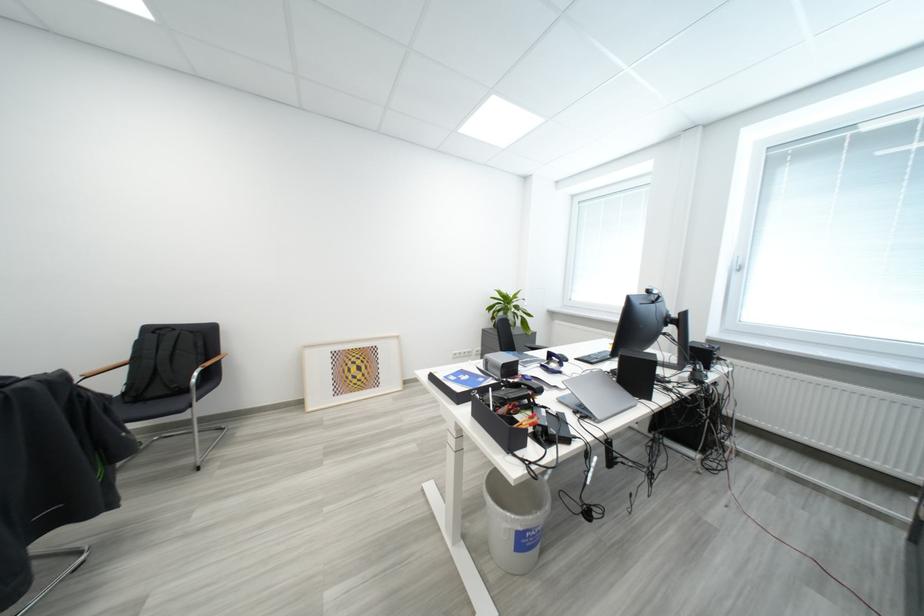
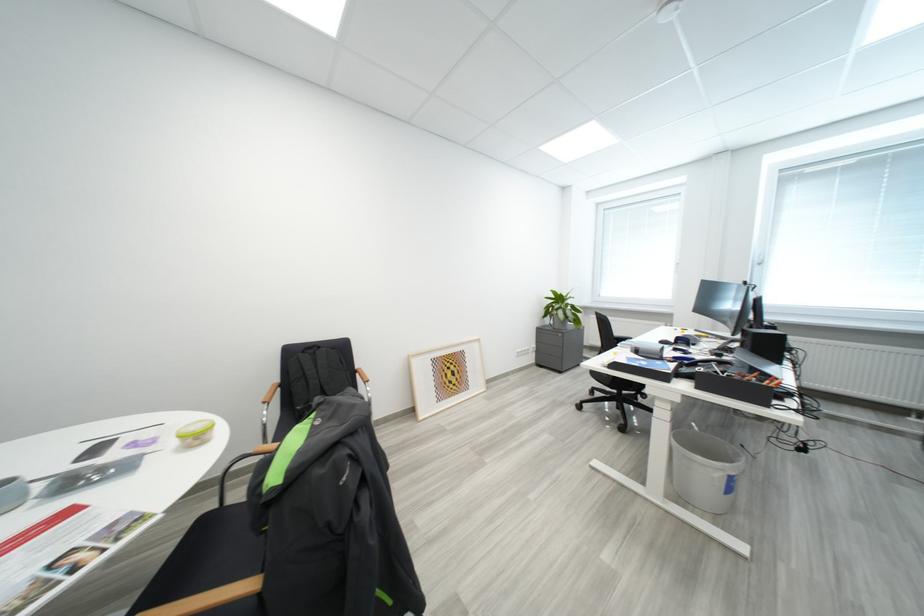
Question: In a continuous first-person perspective shot, in which direction is the camera moving?

Choices:
 (A) Left
 (B) Right
 (C) Forward
 (D) Backward

Answer: (A)